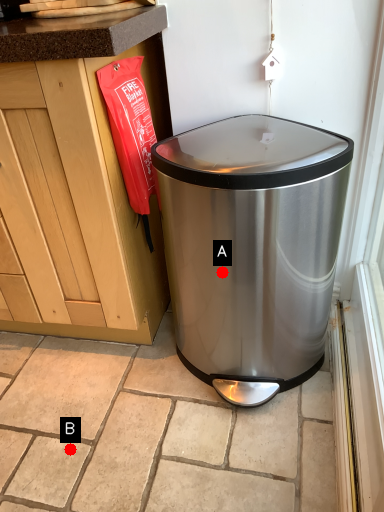
Question: Two points are circled on the image, labeled by A and B beside each circle. Which of the following is the closest to the observer?

Choices:
 (A) A is closer
 (B) B is closer

Answer: (A)